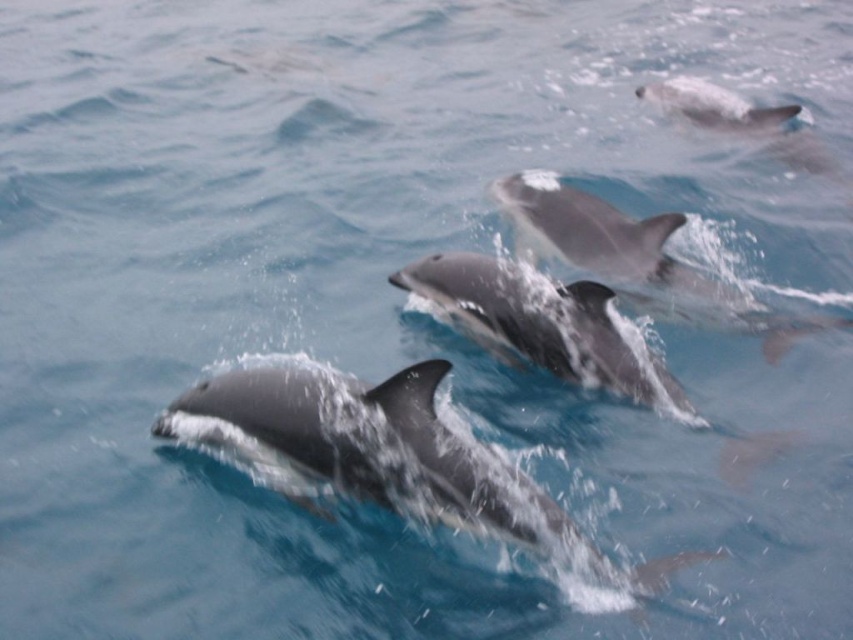
Question: Which point appears closest to the camera in this image?

Choices:
 (A) (287, 394)
 (B) (724, 122)

Answer: (A)

Question: Is smooth gray dolphin at center to the left of smooth gray dolphin at upper right from the viewer's perspective?

Choices:
 (A) no
 (B) yes

Answer: (B)

Question: Which object appears farthest from the camera in this image?

Choices:
 (A) smooth gray dolphin at upper right
 (B) smooth gray dolphin at center

Answer: (A)

Question: Does smooth gray dolphin at center appear on the right side of glossy gray dolphin at center?

Choices:
 (A) yes
 (B) no

Answer: (B)

Question: Where is glossy gray dolphin at center located in relation to smooth gray dolphin at upper right in the image?

Choices:
 (A) right
 (B) left

Answer: (B)

Question: Which object is farther from the camera taking this photo?

Choices:
 (A) smooth gray dolphin at upper right
 (B) glossy gray dolphin at center
 (C) smooth gray dolphin at center

Answer: (A)